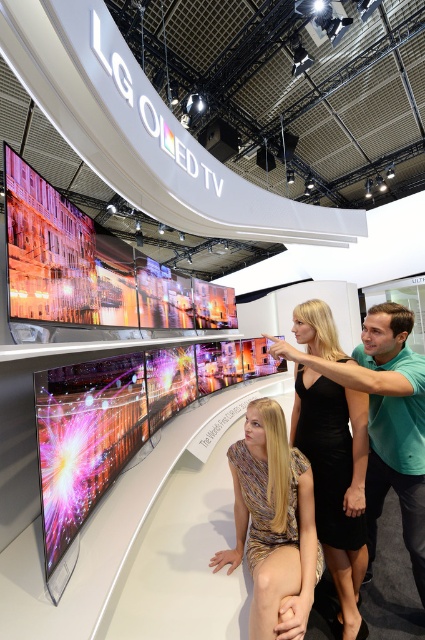
Based on the photo, you are a photographer standing in front of the LG OLED TV booth. You notice two people wearing different outfits in the foreground. The outfits are the metallic gold dress at center and the green matte shirt at center. Which outfit would you need to zoom in closer to capture details of, considering their sizes?

The metallic gold dress at center is smaller than the green matte shirt at center, so you would need to zoom in closer to capture details of the metallic gold dress at center.

You are a photographer standing in front of the LG OLED TV display. You want to take a photo of the metallic gold dress at center and the green matte shirt at center so that both are in focus. Given that your camera has a depth of field that can cover 20 inches, will you be able to capture both subjects clearly in the same shot?

The distance between the metallic gold dress at center and the green matte shirt at center is 21.02 inches. Since the camera can only cover 20 inches, the depth of field is insufficient to keep both subjects in focus simultaneously. You may need to adjust your camera settings or position to ensure both are within the desired focus range.